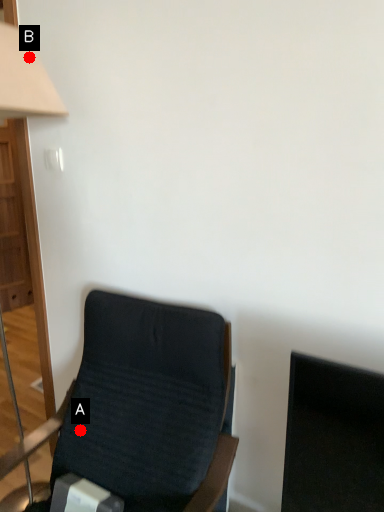
Question: Two points are circled on the image, labeled by A and B beside each circle. Among these points, which one is nearest to the camera?

Choices:
 (A) A is closer
 (B) B is closer

Answer: (B)